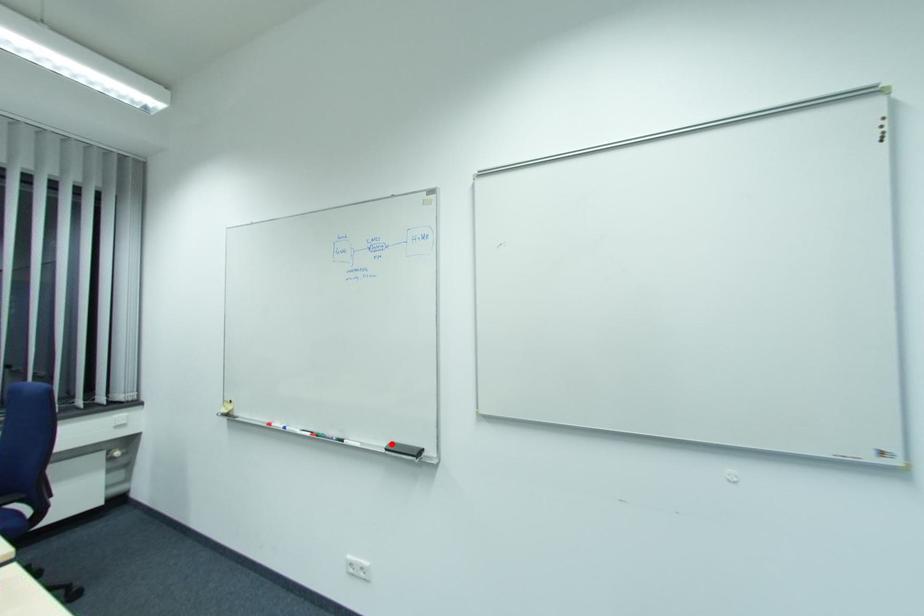
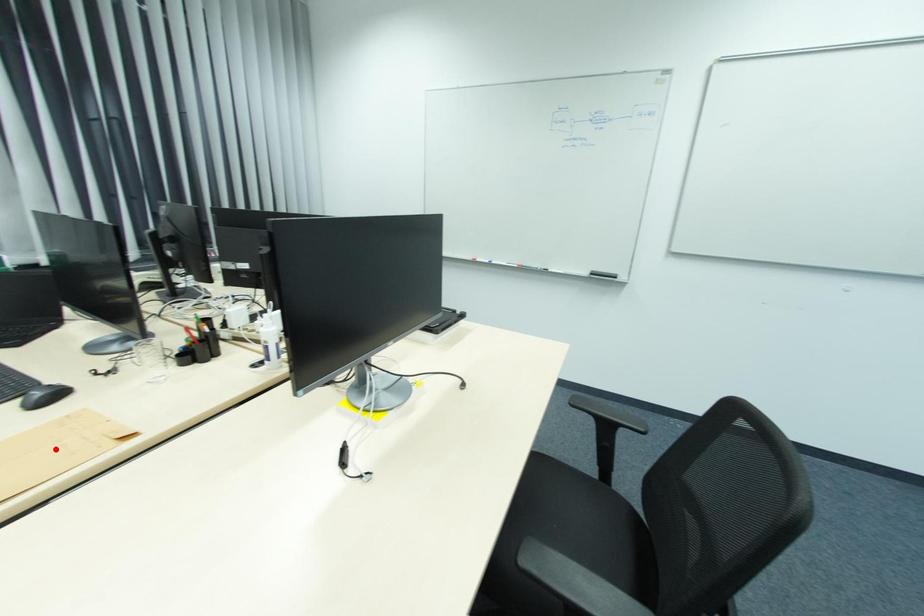
I am providing you with two images of the same scene from different viewpoints. A red point is marked on the first image and another point is marked on the second image. Does the point marked in image1 correspond to the same location as the one in image2?

No